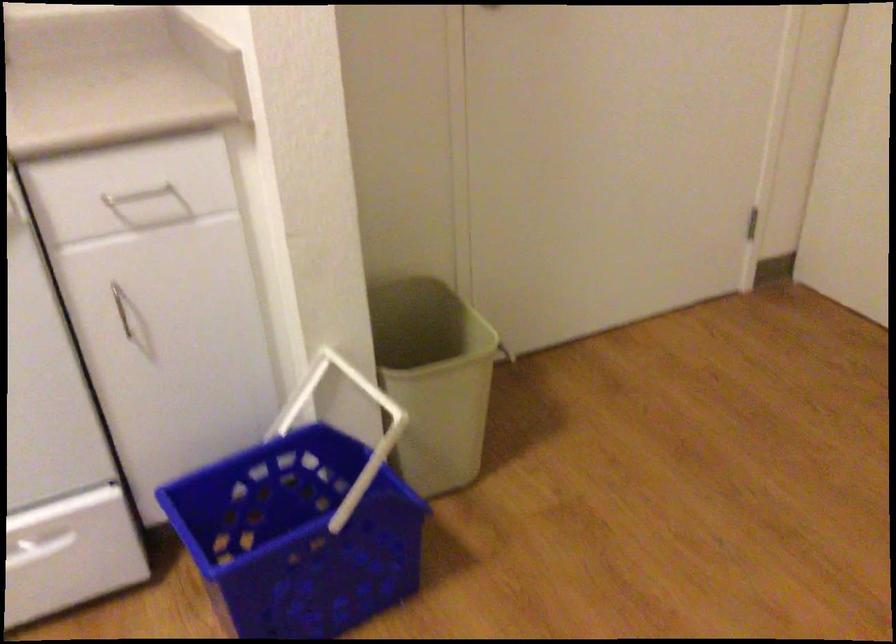
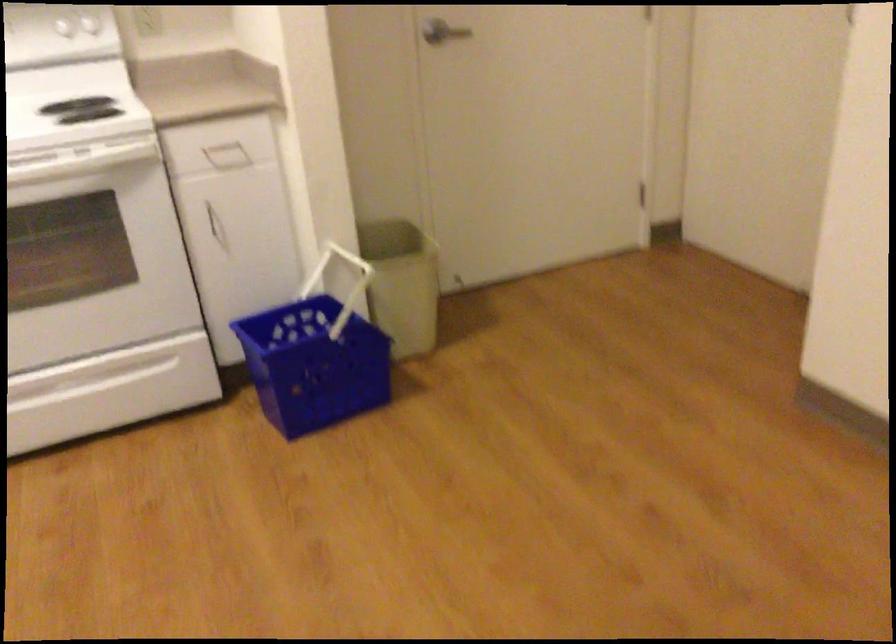
In the second image, find the point that corresponds to point (337, 391) in the first image.

(337, 272)